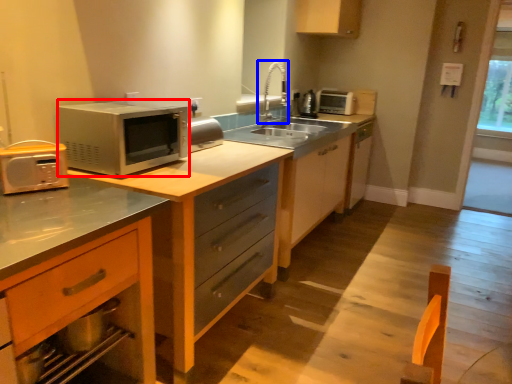
Question: Among these objects, which one is farthest to the camera, microwave oven (highlighted by a red box) or faucet (highlighted by a blue box)?

Choices:
 (A) microwave oven
 (B) faucet

Answer: (B)